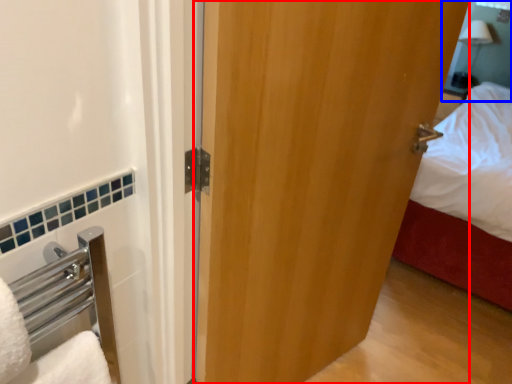
Question: Which object is closer to the camera taking this photo, door (highlighted by a red box) or mirror (highlighted by a blue box)?

Choices:
 (A) door
 (B) mirror

Answer: (A)